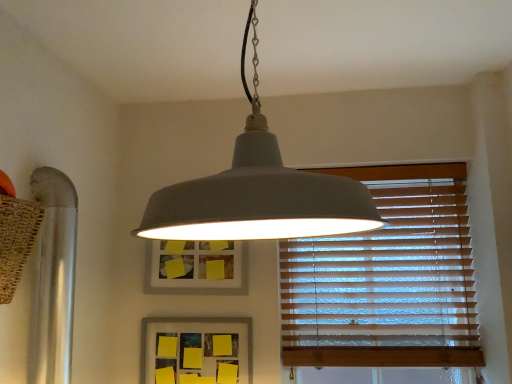
Question: Is matte gray picture frame at center, acting as the first picture frame starting from the top, in front of or behind yellow matte picture frame at center, which appears as the 1th picture frame when ordered from the bottom, in the image?

Choices:
 (A) behind
 (B) front

Answer: (A)

Question: Based on their sizes in the image, would you say matte gray picture frame at center, acting as the first picture frame starting from the top, is bigger or smaller than yellow matte picture frame at center, which appears as the 1th picture frame when ordered from the bottom?

Choices:
 (A) big
 (B) small

Answer: (A)

Question: Based on their relative distances, which object is farther from the yellow matte picture frame at center, which appears as the second picture frame when viewed from the top?

Choices:
 (A) matte gray picture frame at center, acting as the first picture frame starting from the top
 (B) matte gray pendant light at center
 (C) wooden blinds at right

Answer: (B)

Question: Which is farther from the matte gray picture frame at center, acting as the first picture frame starting from the top?

Choices:
 (A) matte gray pendant light at center
 (B) wooden blinds at right
 (C) yellow matte picture frame at center, which appears as the second picture frame when viewed from the top

Answer: (A)